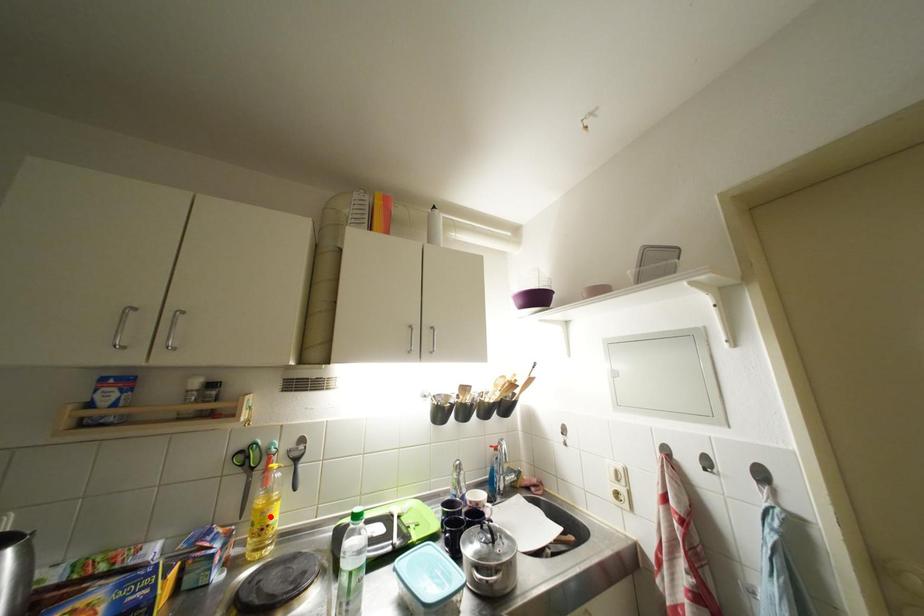
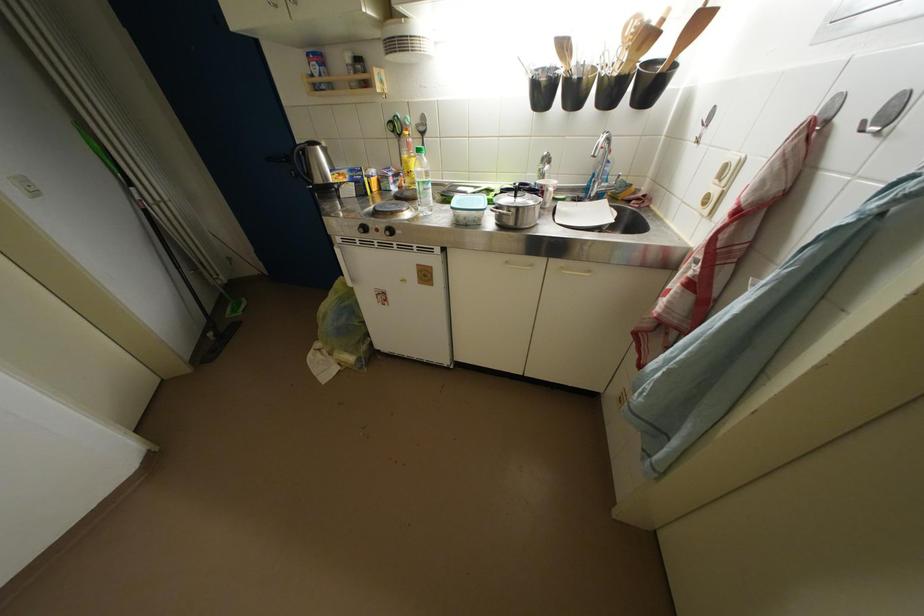
Question: I am providing you with two images of the same scene from different viewpoints. A red point is marked on the first image. Can you still see the location of the red point in image 2?

Choices:
 (A) Yes
 (B) No

Answer: (A)